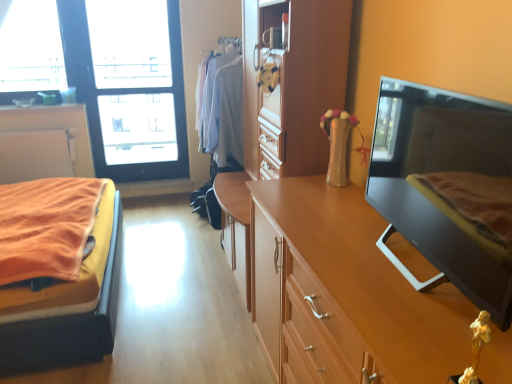
Where is `wooden cabinet at right, which ranks as the first cabinetry in right-to-left order`? The width and height of the screenshot is (512, 384). wooden cabinet at right, which ranks as the first cabinetry in right-to-left order is located at coordinates (345, 292).

The height and width of the screenshot is (384, 512). Describe the element at coordinates (54, 128) in the screenshot. I see `white matte radiator at left, which is the first cabinetry from left to right` at that location.

The width and height of the screenshot is (512, 384). What do you see at coordinates (134, 79) in the screenshot? I see `transparent glass window at upper left` at bounding box center [134, 79].

The height and width of the screenshot is (384, 512). Find the location of `orange fabric bed at left`. orange fabric bed at left is located at coordinates (67, 326).

Locate an element on the screen. The height and width of the screenshot is (384, 512). wooden dresser at center is located at coordinates (284, 103).

Between transparent glass window at upper left and wooden cabinet at right, which is counted as the second cabinetry, starting from the top, which one has smaller size?

Smaller between the two is transparent glass window at upper left.

Which is more to the right, transparent glass window at upper left or wooden cabinet at right, which ranks as the first cabinetry in right-to-left order?

wooden cabinet at right, which ranks as the first cabinetry in right-to-left order.

This screenshot has width=512, height=384. I want to click on window screen located above the wooden cabinet at right, arranged as the second cabinetry when viewed from the left (from the image's perspective), so click(x=134, y=79).

Considering the points (98, 94) and (336, 334), which point is behind, point (98, 94) or point (336, 334)?

Point (98, 94)

From the image's perspective, is wooden cabinet at right, arranged as the second cabinetry when viewed from the left, over orange fabric bed at left?

No.

Is wooden cabinet at right, which is counted as the second cabinetry, starting from the top, shorter than orange fabric bed at left?

No.

Where is `bed above the wooden cabinet at right, which is counted as the second cabinetry, starting from the top (from the image's perspective)`? bed above the wooden cabinet at right, which is counted as the second cabinetry, starting from the top (from the image's perspective) is located at coordinates (67, 326).

Is wooden cabinet at right, which ranks as the first cabinetry in right-to-left order, wider than orange fabric bed at left?

No.

From their relative heights in the image, would you say transparent glass window at upper left is taller or shorter than black glossy tv at right?

Clearly, transparent glass window at upper left is taller compared to black glossy tv at right.

Can you confirm if transparent glass window at upper left is positioned to the right of black glossy tv at right?

Incorrect, transparent glass window at upper left is not on the right side of black glossy tv at right.

Based on the photo, can you tell me how much transparent glass window at upper left and black glossy tv at right differ in facing direction?

The angle between the facing direction of transparent glass window at upper left and the facing direction of black glossy tv at right is 96.9 degrees.

Does transparent glass window at upper left have a lesser width compared to black glossy tv at right?

Yes, transparent glass window at upper left is thinner than black glossy tv at right.

From the image's perspective, relative to orange fabric bed at left, is transparent glass window at upper left above or below?

transparent glass window at upper left is above orange fabric bed at left.

Between transparent glass window at upper left and orange fabric bed at left, which one has smaller size?

transparent glass window at upper left is smaller.

Which is closer to the camera, (125, 89) or (110, 276)?

Point (125, 89) appears to be farther away from the viewer than point (110, 276).

Is transparent glass window at upper left looking in the opposite direction of orange fabric bed at left?

No.

How different are the orientations of wooden cabinet at right, the 1th cabinetry in the front-to-back sequence, and black glossy tv at right in degrees?

wooden cabinet at right, the 1th cabinetry in the front-to-back sequence, and black glossy tv at right are facing 7.38 degrees away from each other.

This screenshot has height=384, width=512. Find the location of `cabinetry below the black glossy tv at right (from the image's perspective)`. cabinetry below the black glossy tv at right (from the image's perspective) is located at coordinates point(345,292).

Which object is thinner, wooden cabinet at right, the 1th cabinetry in the front-to-back sequence, or black glossy tv at right?

With smaller width is black glossy tv at right.

Considering their positions, is wooden cabinet at right, which is counted as the second cabinetry, starting from the top, located in front of or behind black glossy tv at right?

Clearly, wooden cabinet at right, which is counted as the second cabinetry, starting from the top, is behind black glossy tv at right.

Can we say black glossy tv at right lies outside white matte radiator at left, which is the second cabinetry from bottom to top?

Yes.

Looking at the image, does black glossy tv at right seem bigger or smaller compared to white matte radiator at left, the first cabinetry when ordered from top to bottom?

Considering their sizes, black glossy tv at right takes up more space than white matte radiator at left, the first cabinetry when ordered from top to bottom.

Find the location of a particular element. Image resolution: width=512 pixels, height=384 pixels. the 2nd cabinetry behind the black glossy tv at right is located at coordinates (54, 128).

Which object is positioned more to the left, black glossy tv at right or white matte radiator at left, which is the first cabinetry from left to right?

From the viewer's perspective, white matte radiator at left, which is the first cabinetry from left to right, appears more on the left side.

Does wooden cabinet at right, which ranks as the first cabinetry in right-to-left order, have a lesser width compared to wooden dresser at center?

Indeed, wooden cabinet at right, which ranks as the first cabinetry in right-to-left order, has a lesser width compared to wooden dresser at center.

Is wooden cabinet at right, arranged as the second cabinetry when viewed from the left, not inside wooden dresser at center?

wooden cabinet at right, arranged as the second cabinetry when viewed from the left, is positioned outside wooden dresser at center.

Does point (423, 274) appear closer or farther from the camera than point (271, 152)?

Point (423, 274) appears to be closer to the viewer than point (271, 152).

Identify the location of dresser above the wooden cabinet at right, marked as the first cabinetry in a bottom-to-top arrangement (from a real-world perspective). (284, 103).

I want to click on window screen that appears above the wooden cabinet at right, the 1th cabinetry in the front-to-back sequence (from a real-world perspective), so click(x=134, y=79).

At what (x,y) coordinates should I click in order to perform the action: click on cabinetry in front of the orange fabric bed at left. Please return your answer as a coordinate pair (x, y). This screenshot has width=512, height=384. Looking at the image, I should click on (345, 292).

When comparing their distances from black glossy tv at right, does wooden dresser at center or orange fabric bed at left seem closer?

wooden dresser at center.

Estimate the real-world distances between objects in this image. Which object is further from orange fabric bed at left, transparent glass window at upper left or white matte radiator at left, the first cabinetry when ordered from top to bottom?

Based on the image, transparent glass window at upper left appears to be further to orange fabric bed at left.

Which object lies further to the anchor point wooden cabinet at right, which is the 2th cabinetry in back-to-front order, wooden dresser at center or orange fabric bed at left?

Based on the image, orange fabric bed at left appears to be further to wooden cabinet at right, which is the 2th cabinetry in back-to-front order.

Based on the photo, which object lies further to the anchor point white matte radiator at left, which is the first cabinetry from left to right, wooden dresser at center or transparent glass window at upper left?

Based on the image, wooden dresser at center appears to be further to white matte radiator at left, which is the first cabinetry from left to right.

From the image, which object appears to be farther from transparent glass window at upper left, white matte radiator at left, positioned as the first cabinetry in back-to-front order, or orange fabric bed at left?

Based on the image, orange fabric bed at left appears to be further to transparent glass window at upper left.

Looking at the image, which one is located closer to white matte radiator at left, which is the first cabinetry from left to right, wooden dresser at center or black glossy tv at right?

wooden dresser at center is closer to white matte radiator at left, which is the first cabinetry from left to right.

Looking at this image, considering their positions, is orange fabric bed at left positioned further to wooden dresser at center than white matte radiator at left, which is the first cabinetry from left to right?

white matte radiator at left, which is the first cabinetry from left to right, is further to wooden dresser at center.

Looking at the image, which one is located further to black glossy tv at right, wooden cabinet at right, marked as the first cabinetry in a bottom-to-top arrangement, or orange fabric bed at left?

orange fabric bed at left lies further to black glossy tv at right than the other object.

This screenshot has width=512, height=384. Identify the location of cabinetry located between black glossy tv at right and white matte radiator at left, which is the second cabinetry from bottom to top, in the depth direction. (345, 292).

Locate an element on the screen. This screenshot has width=512, height=384. bed positioned between wooden cabinet at right, marked as the first cabinetry in a bottom-to-top arrangement, and white matte radiator at left, acting as the 2th cabinetry starting from the right, from near to far is located at coordinates (67, 326).

At what (x,y) coordinates should I click in order to perform the action: click on dresser between orange fabric bed at left and black glossy tv at right from left to right. Please return your answer as a coordinate pair (x, y). The height and width of the screenshot is (384, 512). Looking at the image, I should click on (284, 103).

Find the location of `dresser between orange fabric bed at left and transparent glass window at upper left from front to back`. dresser between orange fabric bed at left and transparent glass window at upper left from front to back is located at coordinates coord(284,103).